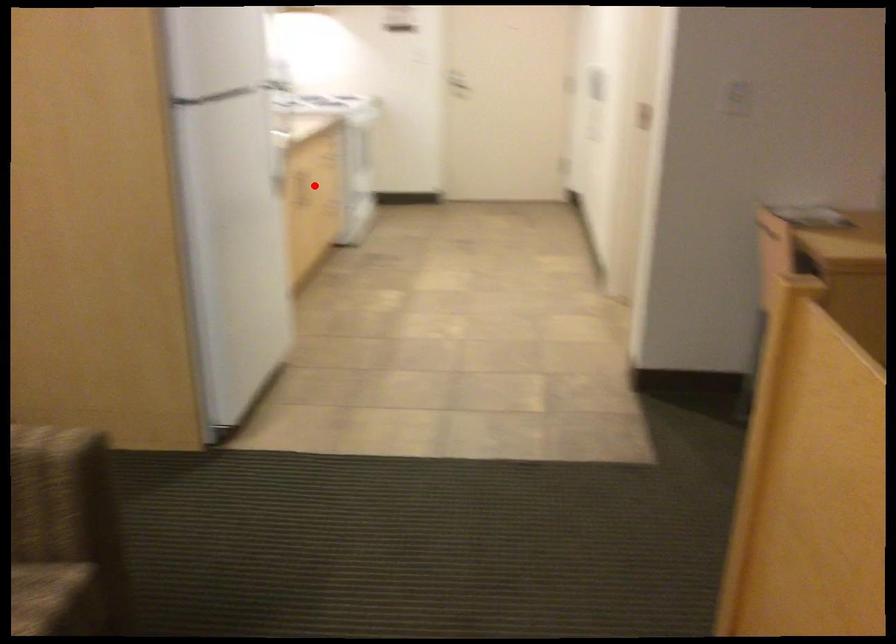
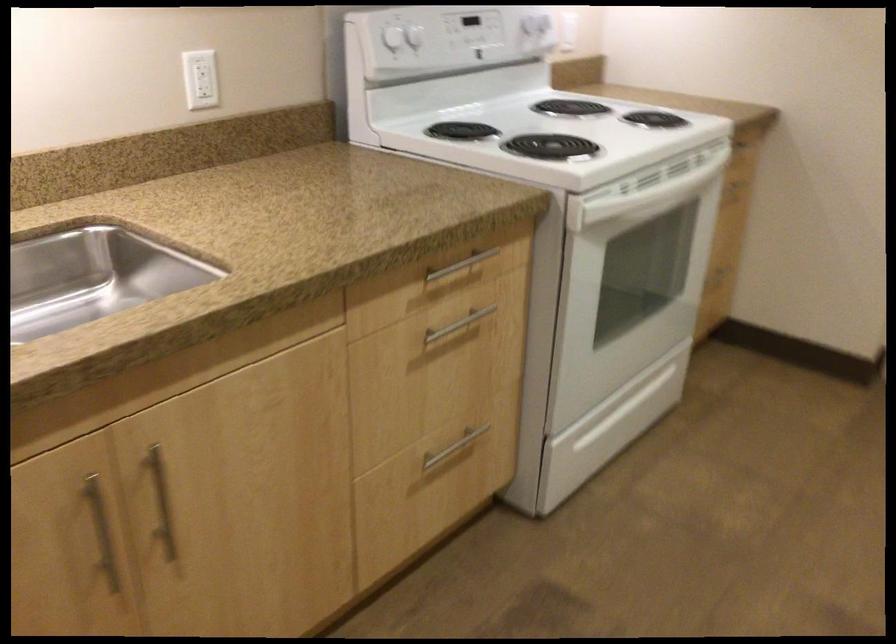
The point at the highlighted location is marked in the first image. Where is the corresponding point in the second image?

(101, 532)